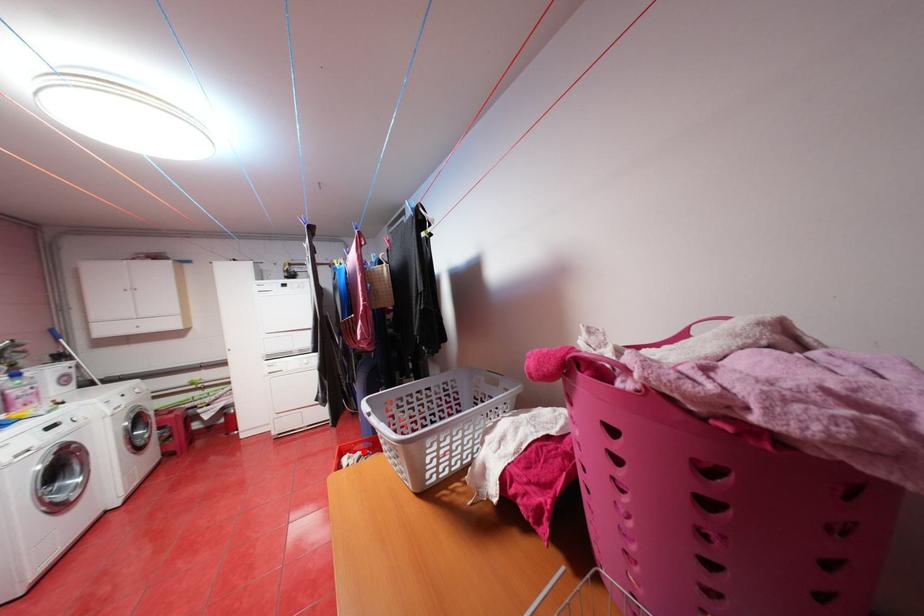
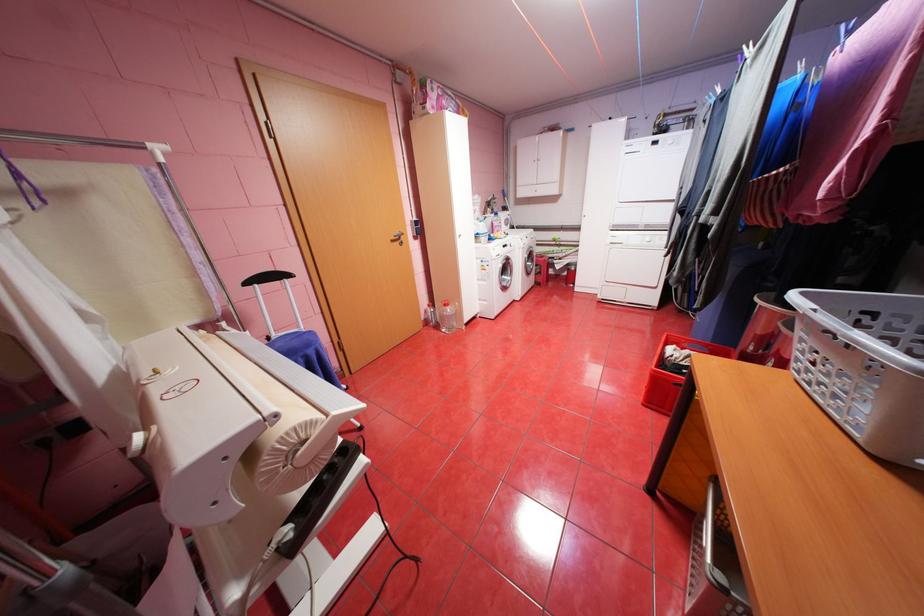
Question: I am providing you with two images of the same scene from different viewpoints. In image1, a red point is highlighted. Considering the same 3D point in image2, which of the following is correct?

Choices:
 (A) It is closer
 (B) It is farther

Answer: (A)